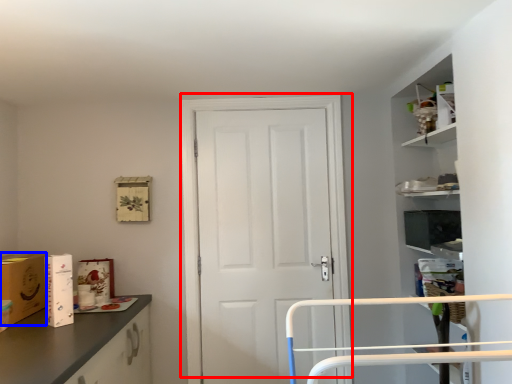
Question: Which of the following is the farthest to the observer, door (highlighted by a red box) or cardboard box (highlighted by a blue box)?

Choices:
 (A) door
 (B) cardboard box

Answer: (A)